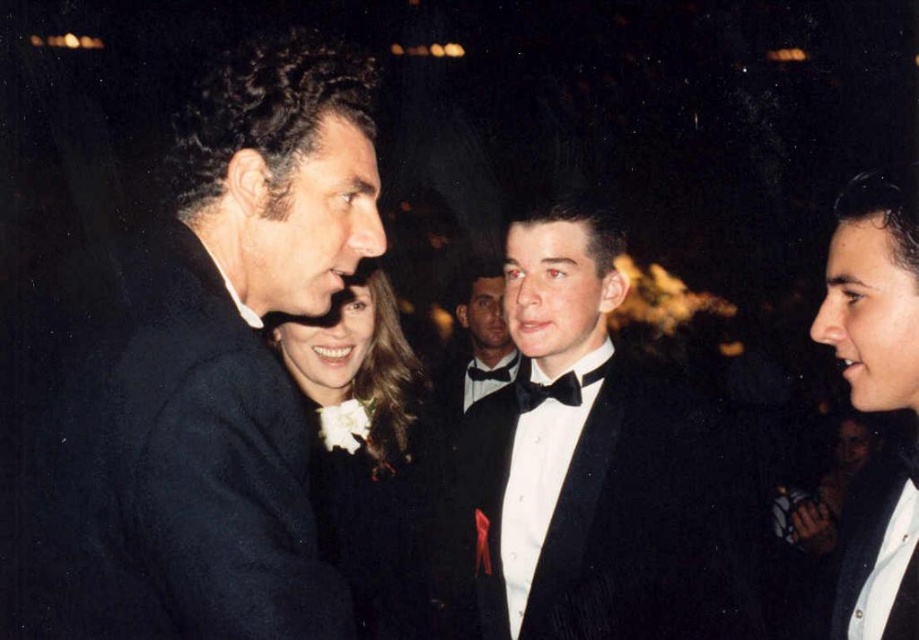
Question: Which object appears farthest from the camera in this image?

Choices:
 (A) black velvet tuxedo at center
 (B) white satin flower at center

Answer: (A)

Question: Does white satin flower at center appear on the right side of shiny black tuxedo at center?

Choices:
 (A) yes
 (B) no

Answer: (B)

Question: Observing the image, what is the correct spatial positioning of black velvet tuxedo at center in reference to white satin flower at center?

Choices:
 (A) below
 (B) above

Answer: (A)

Question: Among these points, which one is farthest from the camera?

Choices:
 (A) (361, 461)
 (B) (201, 172)
 (C) (630, 625)

Answer: (A)

Question: Is black velvet tuxedo at center bigger than shiny black tuxedo at center?

Choices:
 (A) yes
 (B) no

Answer: (B)

Question: Among these points, which one is farthest from the camera?

Choices:
 (A) (472, 272)
 (B) (316, 628)
 (C) (362, 417)

Answer: (A)